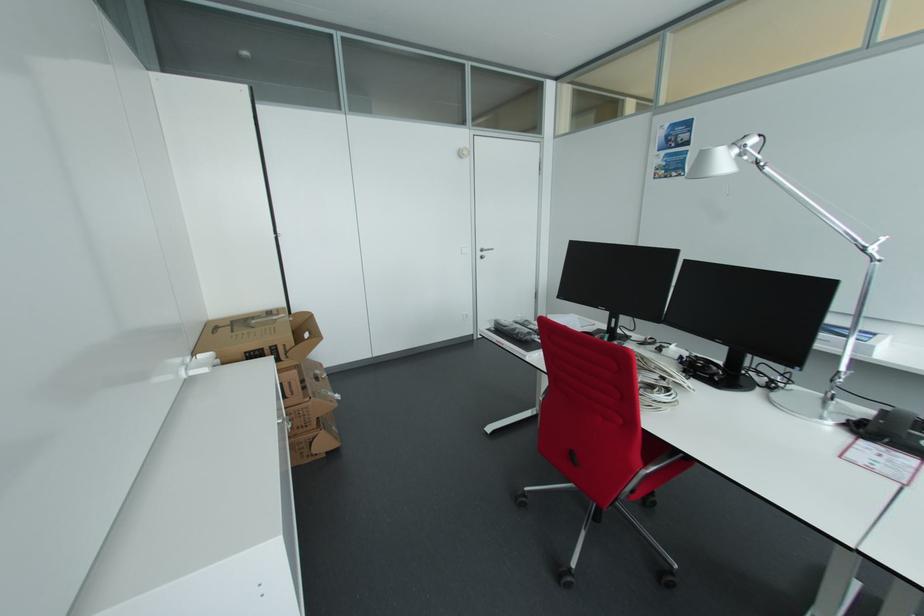
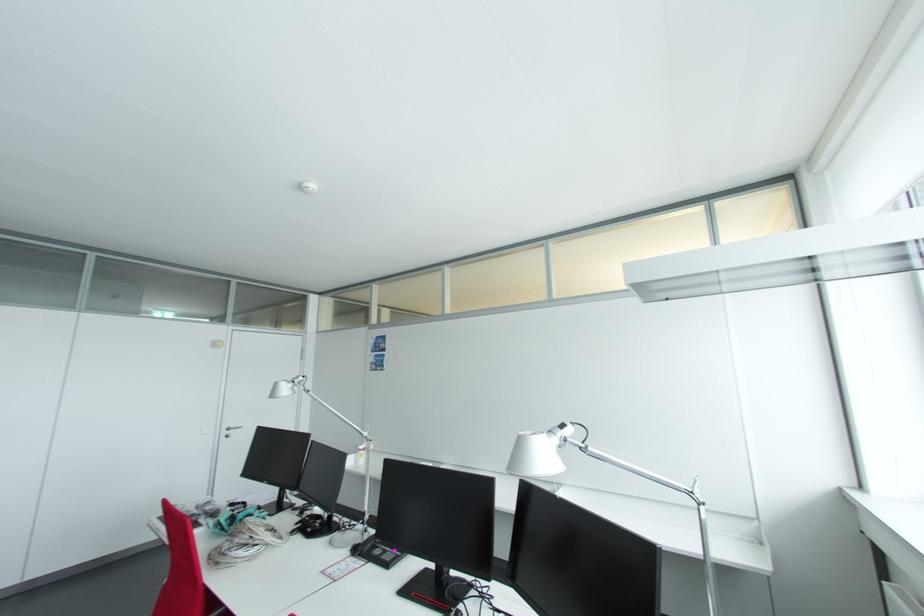
Find the pixel in the second image that matches (865,431) in the first image.

(359, 552)